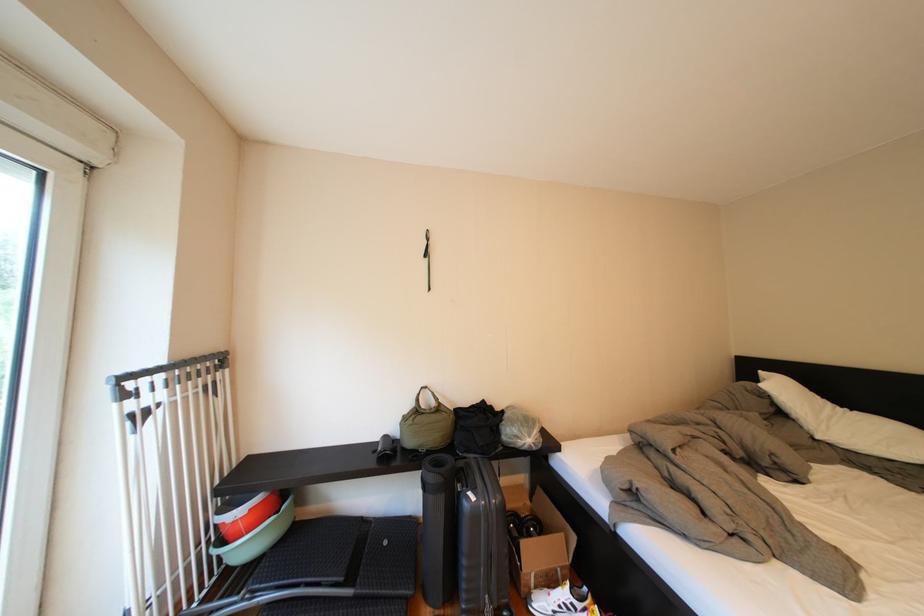
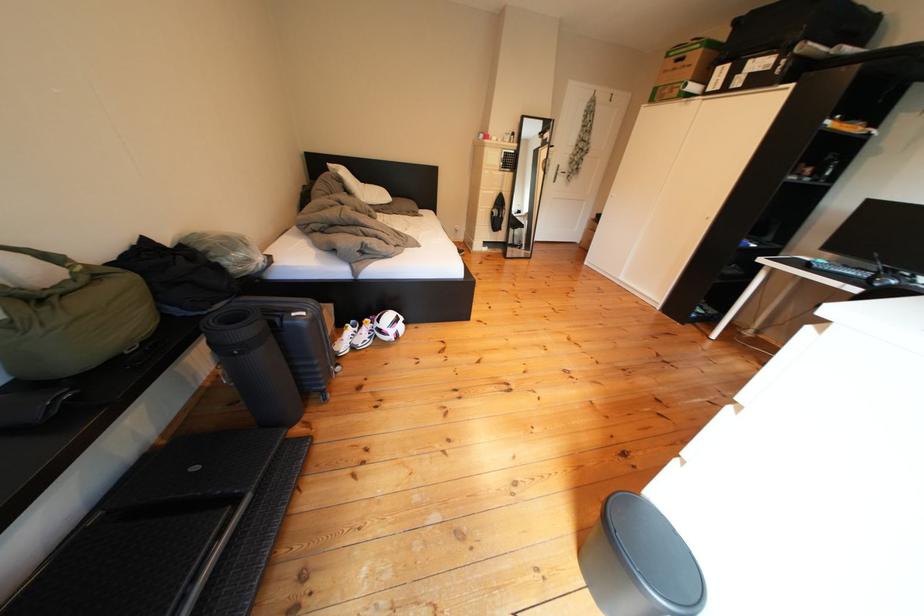
In the second image, find the point that corresponds to [399,546] in the first image.

(209, 474)